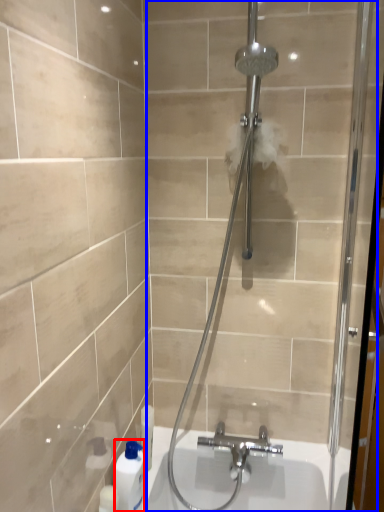
Question: Among these objects, which one is nearest to the camera, cleaning product (highlighted by a red box) or shower door (highlighted by a blue box)?

Choices:
 (A) cleaning product
 (B) shower door

Answer: (B)